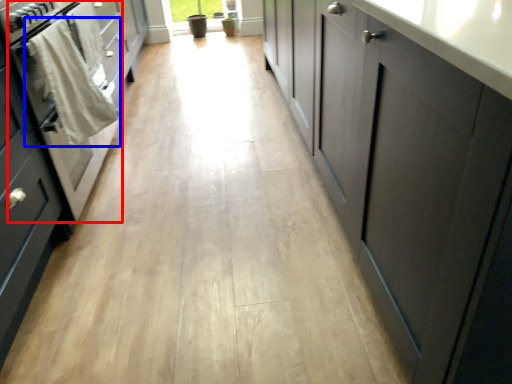
Question: Which object appears farthest to the camera in this image, oven (highlighted by a red box) or laundry (highlighted by a blue box)?

Choices:
 (A) oven
 (B) laundry

Answer: (B)